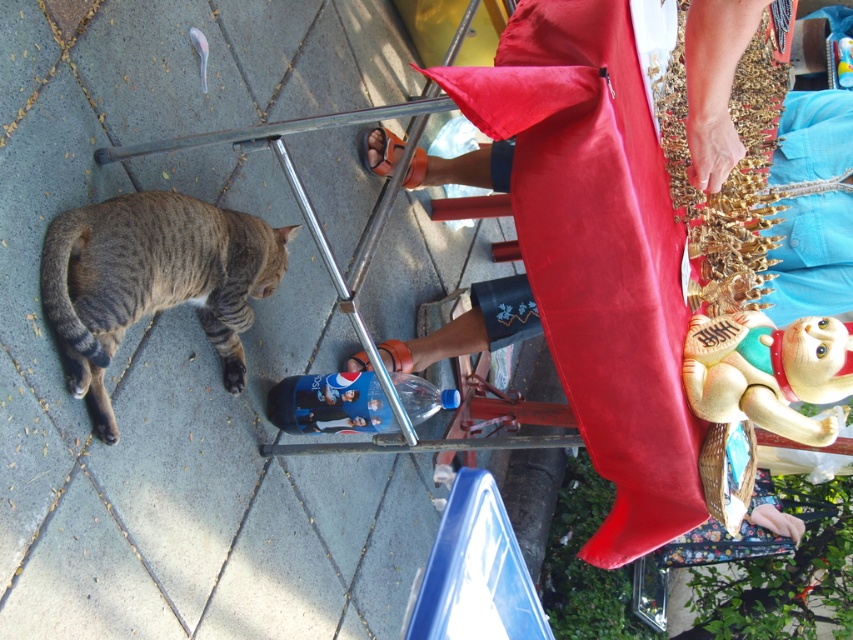
Question: Which of the following is the farthest from the observer?

Choices:
 (A) (166, 540)
 (B) (93, 372)

Answer: (A)

Question: Which object is the closest to the beige rubber cat at lower right?

Choices:
 (A) gray tabby cat at lower left
 (B) gray concrete pavement at lower left

Answer: (A)

Question: Is gray tabby cat at lower left smaller than beige rubber cat at lower right?

Choices:
 (A) no
 (B) yes

Answer: (A)

Question: Based on their relative distances, which object is nearer to the gray tabby cat at lower left?

Choices:
 (A) beige rubber cat at lower right
 (B) gray concrete pavement at lower left

Answer: (B)

Question: Is gray tabby cat at lower left thinner than beige rubber cat at lower right?

Choices:
 (A) yes
 (B) no

Answer: (B)

Question: Does gray tabby cat at lower left have a greater width compared to beige rubber cat at lower right?

Choices:
 (A) no
 (B) yes

Answer: (B)